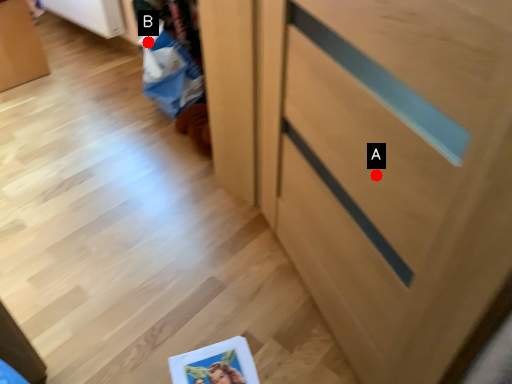
Question: Two points are circled on the image, labeled by A and B beside each circle. Which point is closer to the camera?

Choices:
 (A) A is closer
 (B) B is closer

Answer: (A)